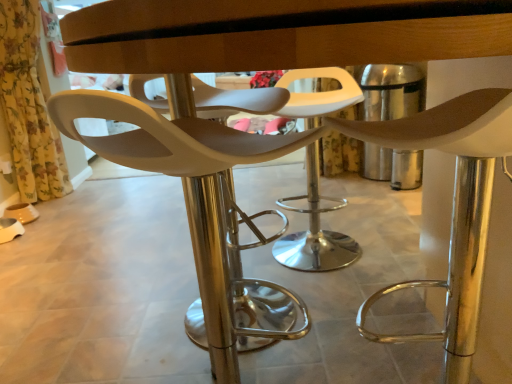
What do you see at coordinates (28, 106) in the screenshot? I see `yellow floral fabric at left` at bounding box center [28, 106].

The image size is (512, 384). Identify the location of yellow floral fabric at left. (28, 106).

Is matte white chair at center, which is the 1th chair from left to right, in contact with matte white chair at center, marked as the first chair in a right-to-left arrangement?

No, matte white chair at center, which is the 1th chair from left to right, is not next to matte white chair at center, marked as the first chair in a right-to-left arrangement.

Is matte white chair at center, which is the 1th chair from left to right, inside the boundaries of matte white chair at center, the second chair in the left-to-right sequence, or outside?

matte white chair at center, which is the 1th chair from left to right, exists outside the volume of matte white chair at center, the second chair in the left-to-right sequence.

Is point (251, 281) in front of point (469, 99)?

No, it is behind (469, 99).

Is matte white chair at center, which is the 1th chair from left to right, at the left side of matte white chair at center, marked as the first chair in a right-to-left arrangement?

Indeed, matte white chair at center, which is the 1th chair from left to right, is positioned on the left side of matte white chair at center, marked as the first chair in a right-to-left arrangement.

From the image's perspective, between matte white chair at center, which is the 1th chair from left to right, and yellow floral fabric at left, which one is located above?

yellow floral fabric at left.

Which object is positioned more to the right, matte white chair at center, acting as the second chair starting from the right, or yellow floral fabric at left?

matte white chair at center, acting as the second chair starting from the right.

Considering the sizes of matte white chair at center, which is the 1th chair from left to right, and yellow floral fabric at left in the image, is matte white chair at center, which is the 1th chair from left to right, taller or shorter than yellow floral fabric at left?

Clearly, matte white chair at center, which is the 1th chair from left to right, is shorter compared to yellow floral fabric at left.

Is point (202, 125) positioned in front of point (20, 77)?

Yes, it is in front of point (20, 77).

From the image's perspective, who appears lower, yellow floral fabric at left or matte white chair at center, marked as the first chair in a right-to-left arrangement?

From the image's view, matte white chair at center, marked as the first chair in a right-to-left arrangement, is below.

Which is closer, (30, 198) or (459, 116)?

Point (30, 198) appears to be farther away from the viewer than point (459, 116).

From a real-world perspective, is yellow floral fabric at left positioned above or below matte white chair at center, the second chair in the left-to-right sequence?

yellow floral fabric at left is above matte white chair at center, the second chair in the left-to-right sequence.

Looking at this image, which object is wider, yellow floral fabric at left or matte white chair at center, the second chair in the left-to-right sequence?

With larger width is matte white chair at center, the second chair in the left-to-right sequence.

From a real-world perspective, between yellow floral fabric at left and matte white chair at center, acting as the second chair starting from the right, who is vertically lower?

matte white chair at center, acting as the second chair starting from the right, from a real-world perspective.

Can matte white chair at center, which is the 1th chair from left to right, be found inside yellow floral fabric at left?

Actually, matte white chair at center, which is the 1th chair from left to right, is outside yellow floral fabric at left.

Who is more distant, yellow floral fabric at left or matte white chair at center, acting as the second chair starting from the right?

yellow floral fabric at left is further away from the camera.

Which is more to the right, yellow floral fabric at left or matte white chair at center, which is the 1th chair from left to right?

matte white chair at center, which is the 1th chair from left to right.

Who is smaller, matte white chair at center, marked as the first chair in a right-to-left arrangement, or matte white chair at center, acting as the second chair starting from the right?

With smaller size is matte white chair at center, acting as the second chair starting from the right.

Is matte white chair at center, marked as the first chair in a right-to-left arrangement, to the left or to the right of matte white chair at center, which is the 1th chair from left to right, in the image?

matte white chair at center, marked as the first chair in a right-to-left arrangement, is to the right of matte white chair at center, which is the 1th chair from left to right.

From the image's perspective, who appears lower, matte white chair at center, the second chair in the left-to-right sequence, or matte white chair at center, acting as the second chair starting from the right?

matte white chair at center, acting as the second chair starting from the right, appears lower in the image.

Is matte white chair at center, the second chair in the left-to-right sequence, wider than yellow floral fabric at left?

Yes.

Considering the sizes of objects matte white chair at center, the second chair in the left-to-right sequence, and yellow floral fabric at left in the image provided, who is taller, matte white chair at center, the second chair in the left-to-right sequence, or yellow floral fabric at left?

Standing taller between the two is yellow floral fabric at left.

Is matte white chair at center, marked as the first chair in a right-to-left arrangement, touching yellow floral fabric at left?

No.

From a real-world perspective, between matte white chair at center, marked as the first chair in a right-to-left arrangement, and yellow floral fabric at left, who is vertically lower?

matte white chair at center, marked as the first chair in a right-to-left arrangement, from a real-world perspective.

Find the location of a particular element. The height and width of the screenshot is (384, 512). chair lying on the right of matte white chair at center, acting as the second chair starting from the right is located at coordinates tap(453, 207).

Locate an element on the screen. The image size is (512, 384). curtain that appears on the left of matte white chair at center, acting as the second chair starting from the right is located at coordinates (28, 106).

From the image, which object appears to be nearer to yellow floral fabric at left, matte white chair at center, marked as the first chair in a right-to-left arrangement, or matte white chair at center, acting as the second chair starting from the right?

matte white chair at center, acting as the second chair starting from the right, is closer to yellow floral fabric at left.

Estimate the real-world distances between objects in this image. Which object is closer to matte white chair at center, the second chair in the left-to-right sequence, matte white chair at center, which is the 1th chair from left to right, or yellow floral fabric at left?

The object closer to matte white chair at center, the second chair in the left-to-right sequence, is matte white chair at center, which is the 1th chair from left to right.

Looking at the image, which one is located further to matte white chair at center, which is the 1th chair from left to right, matte white chair at center, marked as the first chair in a right-to-left arrangement, or yellow floral fabric at left?

Among the two, yellow floral fabric at left is located further to matte white chair at center, which is the 1th chair from left to right.

Estimate the real-world distances between objects in this image. Which object is further from matte white chair at center, acting as the second chair starting from the right, yellow floral fabric at left or matte white chair at center, marked as the first chair in a right-to-left arrangement?

The object further to matte white chair at center, acting as the second chair starting from the right, is yellow floral fabric at left.

Estimate the real-world distances between objects in this image. Which object is closer to matte white chair at center, the second chair in the left-to-right sequence, yellow floral fabric at left or matte white chair at center, acting as the second chair starting from the right?

→ Based on the image, matte white chair at center, acting as the second chair starting from the right, appears to be nearer to matte white chair at center, the second chair in the left-to-right sequence.

Estimate the real-world distances between objects in this image. Which object is closer to yellow floral fabric at left, matte white chair at center, which is the 1th chair from left to right, or matte white chair at center, marked as the first chair in a right-to-left arrangement?

matte white chair at center, which is the 1th chair from left to right, is positioned closer to the anchor yellow floral fabric at left.

Find the location of `chair positioned between matte white chair at center, the second chair in the left-to-right sequence, and yellow floral fabric at left from near to far`. chair positioned between matte white chair at center, the second chair in the left-to-right sequence, and yellow floral fabric at left from near to far is located at coordinates (188, 193).